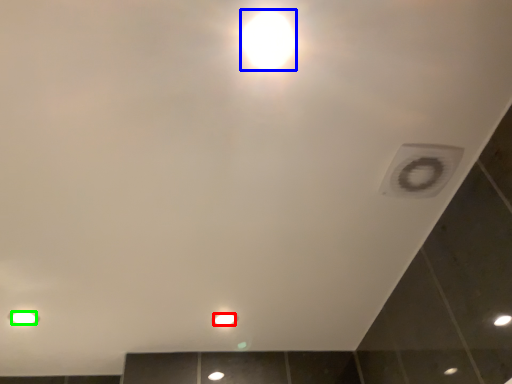
Question: Which object is positioned closest to light bulb (highlighted by a red box)? Select from light bulb (highlighted by a blue box) and light bulb (highlighted by a green box).

Choices:
 (A) light bulb
 (B) light bulb

Answer: (B)